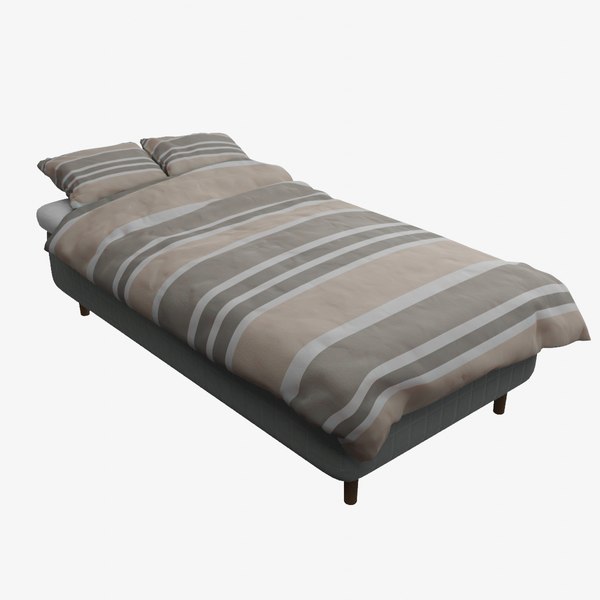
Image resolution: width=600 pixels, height=600 pixels. I want to click on pillows, so click(x=96, y=181), click(x=164, y=158).